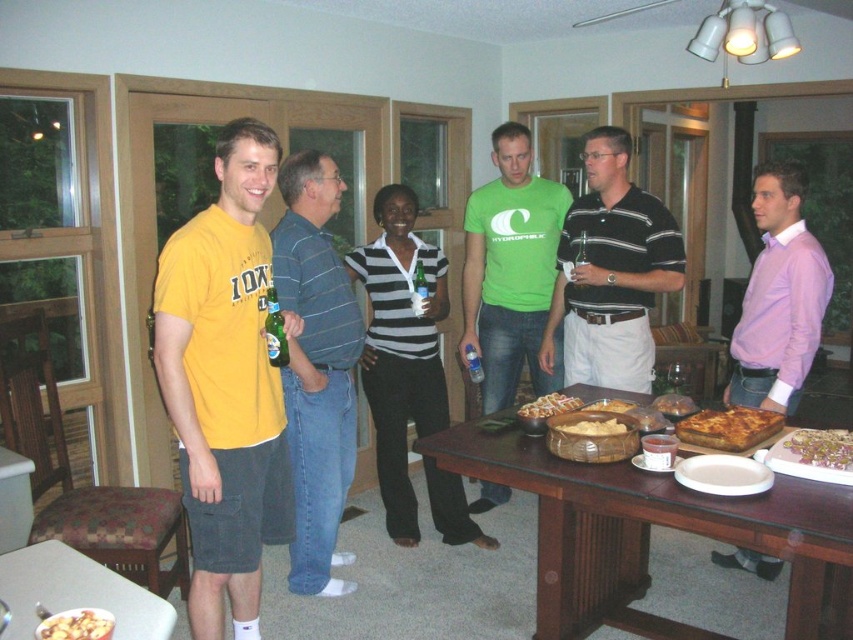
Question: Estimate the real-world distances between objects in this image. Which object is closer to the green cotton t-shirt at center?

Choices:
 (A) golden brown crusty pizza at center
 (B) white matte platter at lower center
 (C) yellow t-shirt at left

Answer: (C)

Question: Can you confirm if brown wooden table at center is wider than green matte bottle at center?

Choices:
 (A) no
 (B) yes

Answer: (B)

Question: Can you confirm if pink satin shirt at center is positioned below green matte bottle at center?

Choices:
 (A) yes
 (B) no

Answer: (A)

Question: Considering the real-world distances, which object is farthest from the black striped polo shirt at center?

Choices:
 (A) green glass bottle at center
 (B) green cotton t-shirt at center

Answer: (A)

Question: Which of these objects is positioned farthest from the golden brown bread at table center?

Choices:
 (A) golden brown flaky pie at center
 (B) green cotton t-shirt at center
 (C) brown wooden table at center
 (D) golden brown crusty pizza at table center

Answer: (B)

Question: Observing the image, what is the correct spatial positioning of golden brown flaky pie at center in reference to golden crispy fries at center?

Choices:
 (A) below
 (B) above

Answer: (B)